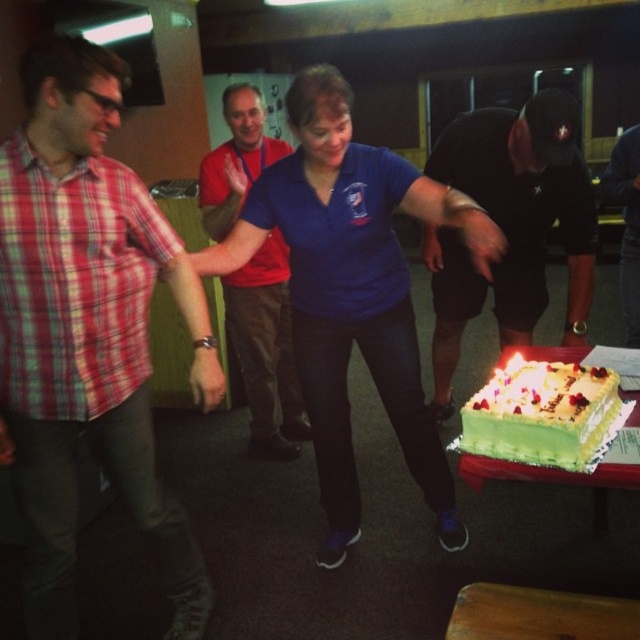
You are at a party and want to hand a drink to both the plaid shirt at left and the black matte shorts at lower right. Which one should you approach first to give the drink?

You should approach the plaid shirt at left first because it is closer to you than the black matte shorts at lower right.